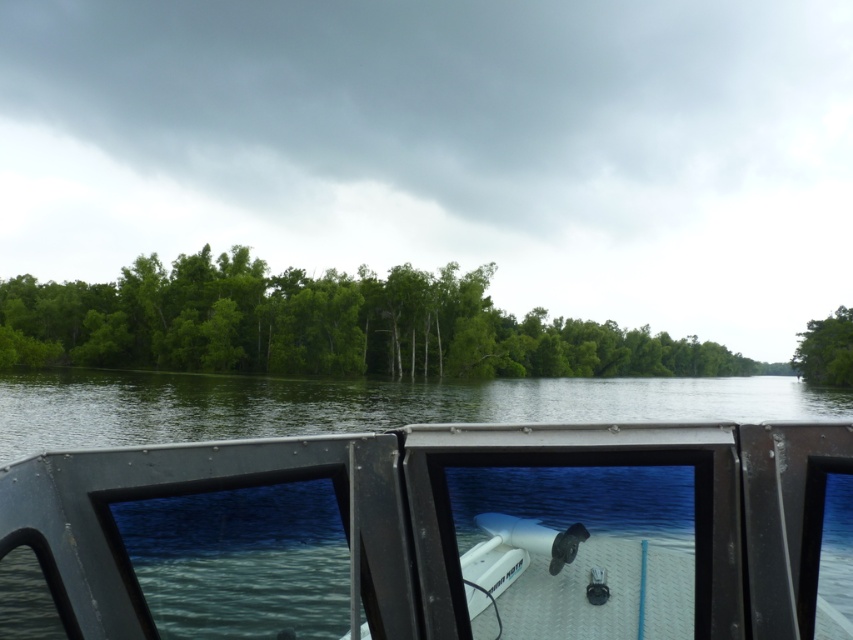
Question: Can you confirm if green leafy trees at center is wider than green leafy tree at right?

Choices:
 (A) yes
 (B) no

Answer: (A)

Question: Estimate the real-world distances between objects in this image. Which object is closer to the green leafy tree at right?

Choices:
 (A) white matte boat at center
 (B) green leafy trees at center

Answer: (B)

Question: Is green leafy trees at center to the right of green leafy tree at right from the viewer's perspective?

Choices:
 (A) yes
 (B) no

Answer: (B)

Question: Where is white matte boat at center located in relation to green leafy trees at center in the image?

Choices:
 (A) below
 (B) above

Answer: (B)

Question: Which is nearer to the green leafy tree at right?

Choices:
 (A) white matte boat at center
 (B) green leafy trees at center

Answer: (B)

Question: Which point is closer to the camera?

Choices:
 (A) white matte boat at center
 (B) green leafy tree at right
 (C) green leafy trees at center

Answer: (A)